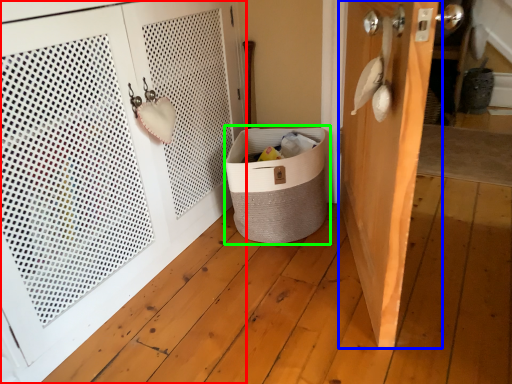
Question: Which is nearer to the door (highlighted by a red box)? door (highlighted by a blue box) or laundry basket (highlighted by a green box).

Choices:
 (A) door
 (B) laundry basket

Answer: (B)